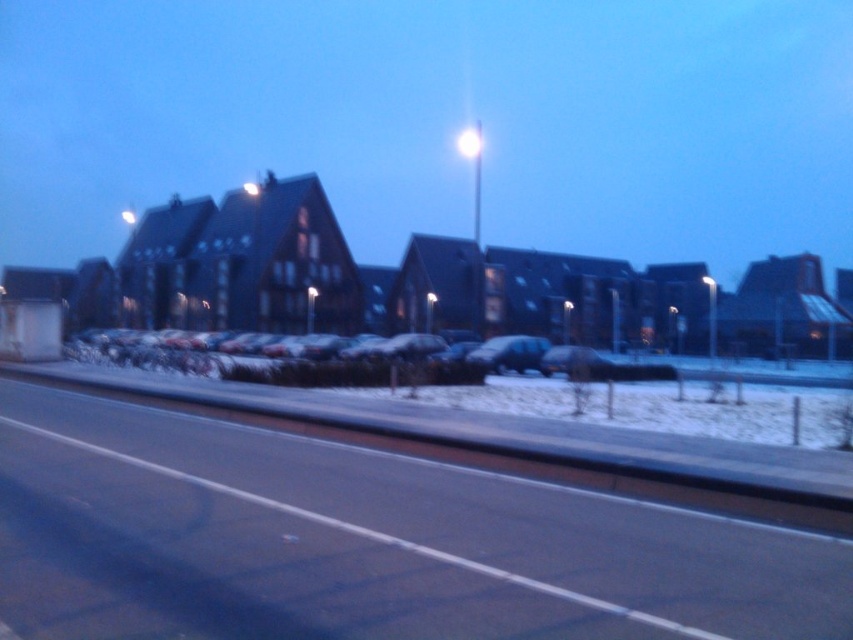
You are standing at the point marked by coordinates point (x=438, y=120) on the smooth concrete street at lower left. What is the direction of the road ahead relative to your current position?

The road ahead extends forward from your current position on the smooth concrete street at lower left.